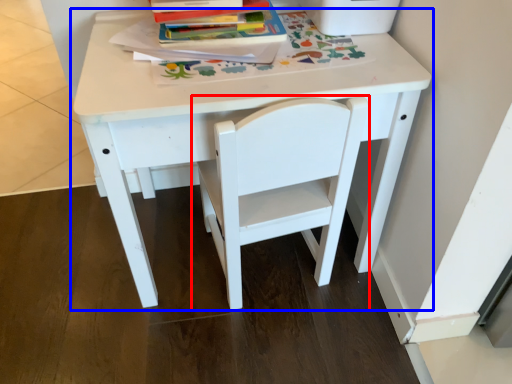
Question: Which point is further to the camera, chair (highlighted by a red box) or table (highlighted by a blue box)?

Choices:
 (A) chair
 (B) table

Answer: (B)